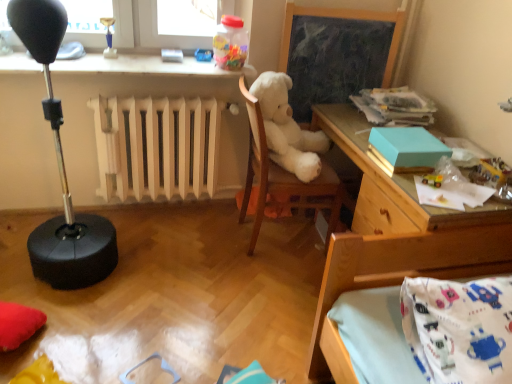
The height and width of the screenshot is (384, 512). Find the location of `free space in front of metallic yellow toy car at upper right, the fourth toy when ordered from back to front`. free space in front of metallic yellow toy car at upper right, the fourth toy when ordered from back to front is located at coordinates (443, 198).